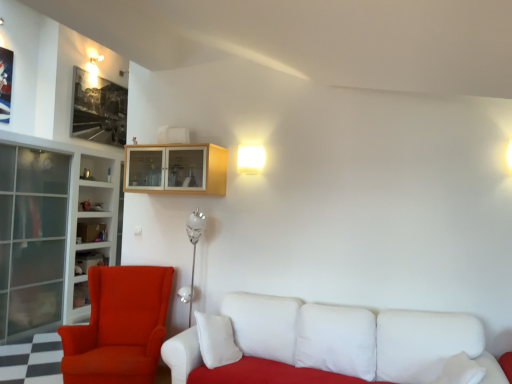
Question: Relative to white fabric couch at lower right, is matte glass shelf at left in front or behind?

Choices:
 (A) front
 (B) behind

Answer: (B)

Question: Based on their sizes in the image, would you say matte glass shelf at left is bigger or smaller than white fabric couch at lower right?

Choices:
 (A) big
 (B) small

Answer: (B)

Question: Estimate the real-world distances between objects in this image. Which object is farther from the white soft pillow at lower right?

Choices:
 (A) light wood cabinet at upper center
 (B) velvet orange armchair at left
 (C) matte glass shelf at left
 (D) transparent glass cabinet at left
 (E) white glass bookshelf at left

Answer: (D)

Question: Which of these objects is positioned farthest from the transparent glass cabinet at left?

Choices:
 (A) matte glass shelf at left
 (B) white fabric couch at lower right
 (C) white glass bookshelf at left
 (D) velvet orange armchair at left
 (E) black matte picture frame at upper left

Answer: (B)